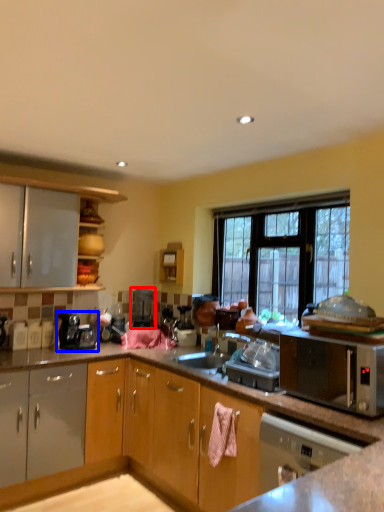
Question: Which object appears farthest to the camera in this image, appliance (highlighted by a red box) or coffee machine (highlighted by a blue box)?

Choices:
 (A) appliance
 (B) coffee machine

Answer: (A)